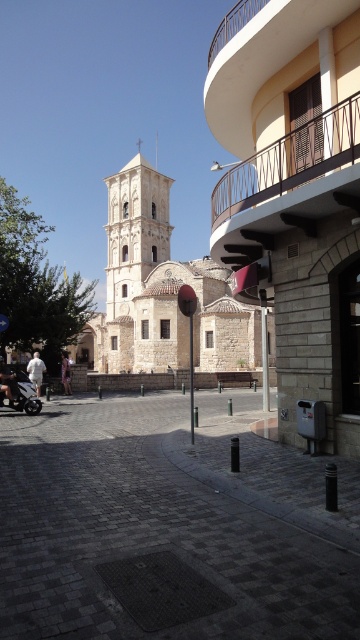
Question: Does dark gray cobblestone at center have a greater width compared to shiny chrome motorcycle at lower left?

Choices:
 (A) no
 (B) yes

Answer: (B)

Question: Does beige stone church at center come behind light beige stone bell tower at center?

Choices:
 (A) yes
 (B) no

Answer: (B)

Question: Which point is closer to the camera?

Choices:
 (A) white cotton shirt at left
 (B) light brown leather jacket at lower left
 (C) dark gray textured manhole cover at center

Answer: (C)

Question: Based on their relative distances, which object is farther from the dark gray textured manhole cover at center?

Choices:
 (A) white cotton shirt at left
 (B) shiny chrome motorcycle at lower left
 (C) light brown leather jacket at lower left

Answer: (A)

Question: Can you confirm if light beige stone bell tower at center is bigger than dark gray textured manhole cover at center?

Choices:
 (A) no
 (B) yes

Answer: (B)

Question: Which of these objects is positioned farthest from the light brown leather jacket at lower left?

Choices:
 (A) dark gray textured manhole cover at center
 (B) white cotton shirt at left
 (C) dark gray cobblestone at center
 (D) light beige stone church at center

Answer: (D)